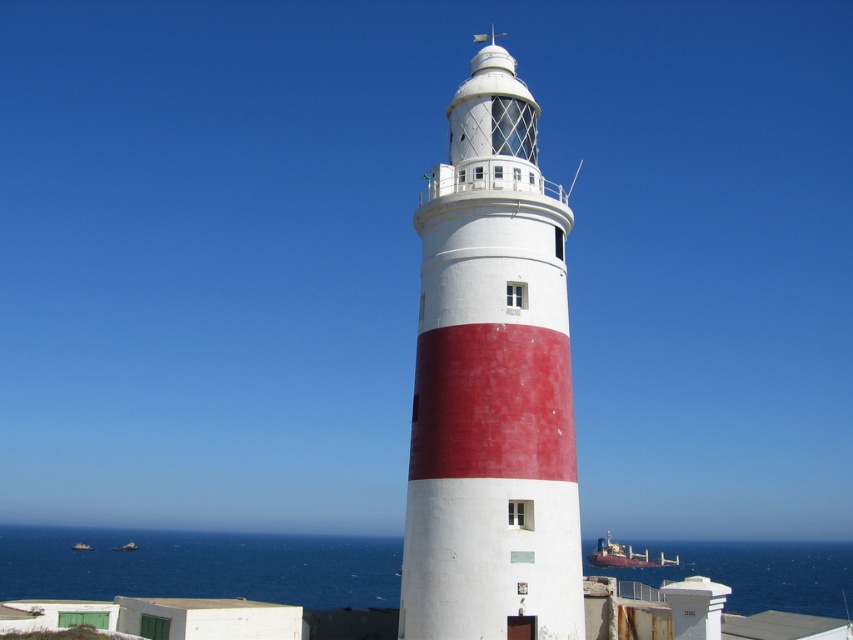
You are standing at the base of the lighthouse and looking up at its structure. There are two points marked on the lighthouse tower. The first point is located at coordinates point [670,560] and the second at point [135,548]. Which point is closer to your current position?

Point [135,548] is closer to your current position because it is closer to the base of the lighthouse, while point [670,560] is further away from you as it is higher up the tower.

You are standing at the top of the lighthouse and looking out. There is a point marked at coordinates (199, 566). What is located at this point in the image?

The point at coordinates (199, 566) indicates blue water at lower center.